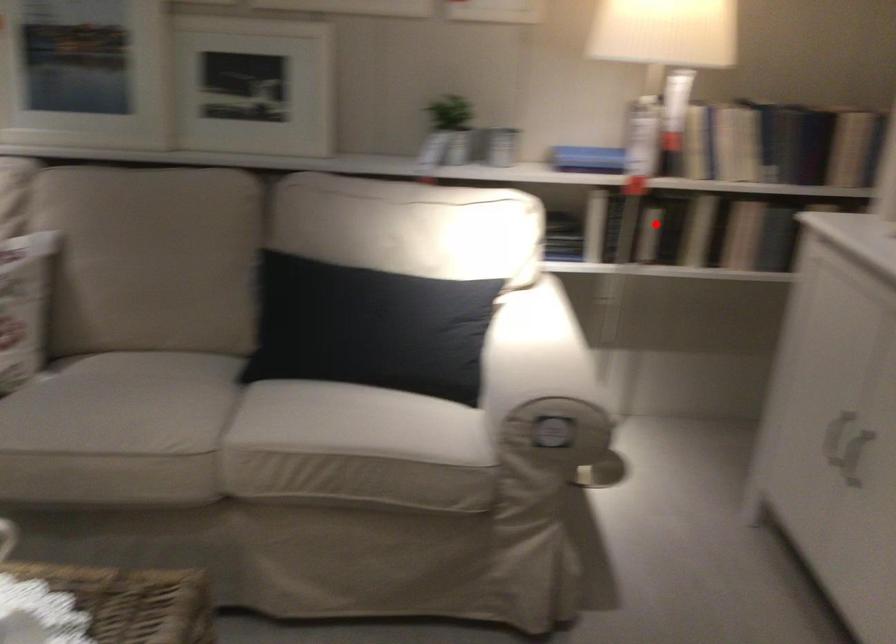
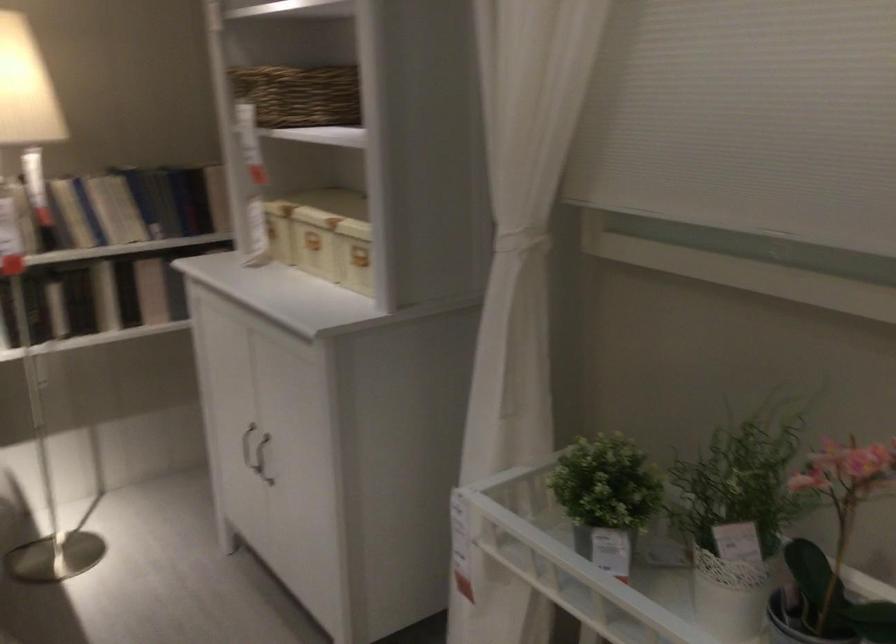
Where in the second image is the point corresponding to the highlighted location from the first image?

(55, 307)